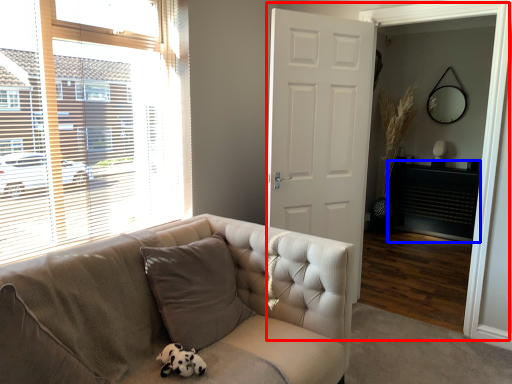
Question: Which point is closer to the camera, screen door (highlighted by a red box) or fireplace (highlighted by a blue box)?

Choices:
 (A) screen door
 (B) fireplace

Answer: (A)